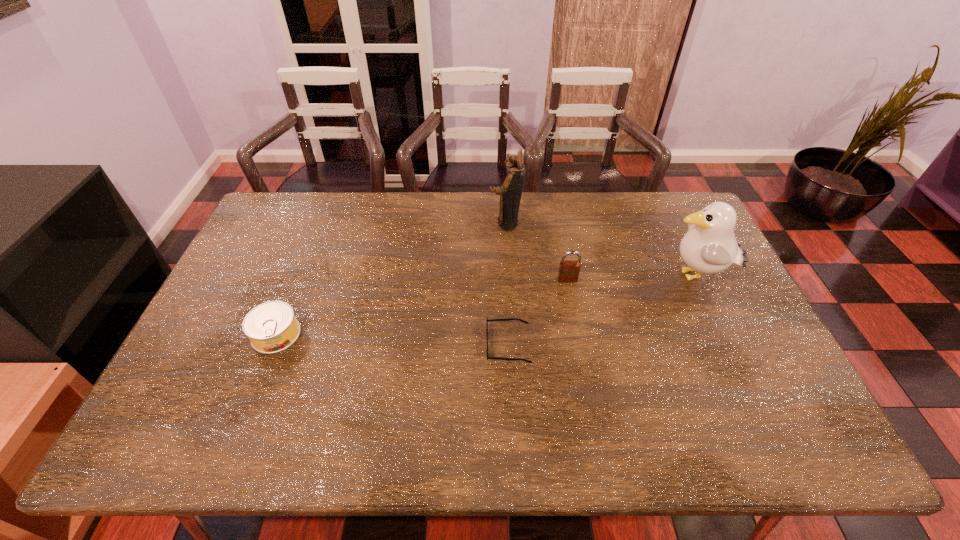
At what (x,y) coordinates should I click in order to perform the action: click on free space between the farthest object and the leftmost object. Please return your answer as a coordinate pair (x, y). This screenshot has height=540, width=960. Looking at the image, I should click on (391, 279).

What are the coordinates of `vacant area that lies between the gull and the shortest object` in the screenshot? It's located at 602,310.

You are a GUI agent. You are given a task and a screenshot of the screen. Output one action in this format:
    pyautogui.click(x=<x>, y=<y>)
    Task: Click on the vacant area that lies between the padlock and the rightmost object
    Image resolution: width=960 pixels, height=540 pixels.
    Given the screenshot: What is the action you would take?
    pyautogui.click(x=631, y=278)

Locate an element on the screen. The width and height of the screenshot is (960, 540). free space between the second object from right to left and the second shortest object is located at coordinates (421, 307).

The image size is (960, 540). Identify the location of vacant area that lies between the can and the rightmost object. (486, 306).

Find the location of a particular element. This screenshot has width=960, height=540. object identified as the fourth closest to the second object from right to left is located at coordinates (271, 327).

Identify which object is the nearest to the padlock. Please provide its 2D coordinates. Your answer should be formatted as a tuple, i.e. [(x, y)], where the tuple contains the x and y coordinates of a point satisfying the conditions above.

[(498, 358)]

Image resolution: width=960 pixels, height=540 pixels. I want to click on vacant space that satisfies the following two spatial constraints: 1. on the beak of the gull; 2. on the front side of the second shortest object, so click(722, 334).

Identify the location of vacant region that satisfies the following two spatial constraints: 1. on the beak of the rightmost object; 2. on the front-facing side of the third shortest object. (696, 280).

Where is `free space that satisfies the following two spatial constraints: 1. on the beak of the rightmost object; 2. on the front-facing side of the padlock`? This screenshot has height=540, width=960. free space that satisfies the following two spatial constraints: 1. on the beak of the rightmost object; 2. on the front-facing side of the padlock is located at coordinates (696, 280).